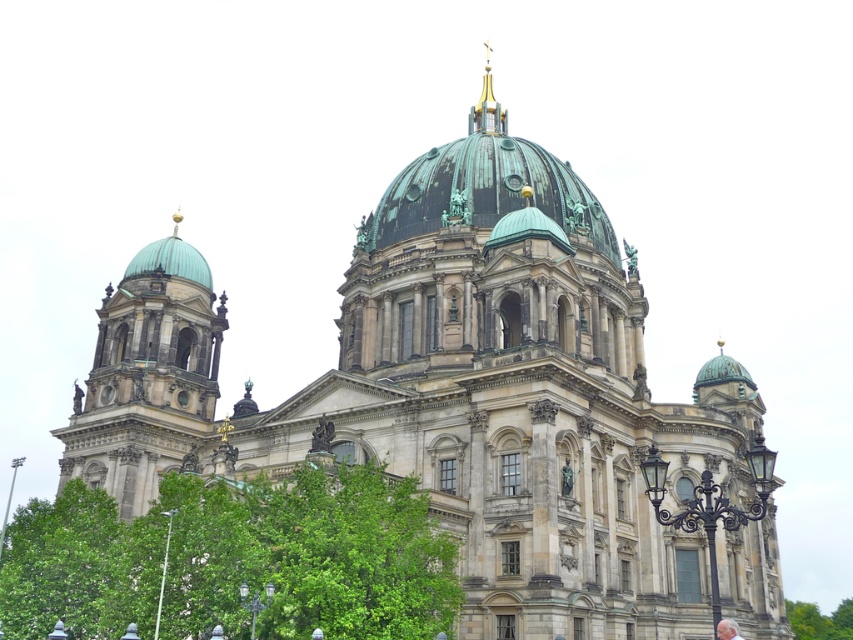
Question: Which is farther from the green leafy tree at lower right?

Choices:
 (A) gold-plated copper spire at upper center
 (B) green leafy tree at center
 (C) green copper dome at left

Answer: (B)

Question: Does green leafy tree at lower right appear under gold-plated copper spire at upper center?

Choices:
 (A) no
 (B) yes

Answer: (B)

Question: Which object is positioned closest to the green leafy tree at lower right?

Choices:
 (A) green copper dome at left
 (B) green leafy tree at center

Answer: (A)

Question: Is green copper dome at left above green leafy tree at lower right?

Choices:
 (A) no
 (B) yes

Answer: (B)

Question: Which object appears farthest from the camera in this image?

Choices:
 (A) gold-plated copper spire at upper center
 (B) green leafy tree at center
 (C) green copper dome at left

Answer: (A)

Question: Where is green leafy tree at lower right located in relation to gold-plated copper spire at upper center in the image?

Choices:
 (A) right
 (B) left

Answer: (A)